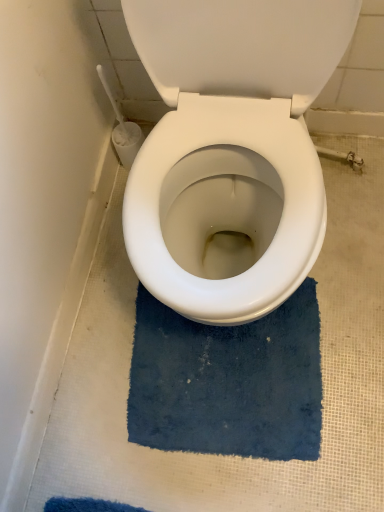
Image resolution: width=384 pixels, height=512 pixels. I want to click on vacant area situated below dark blue plush bath mat at center (from a real-world perspective), so click(x=224, y=396).